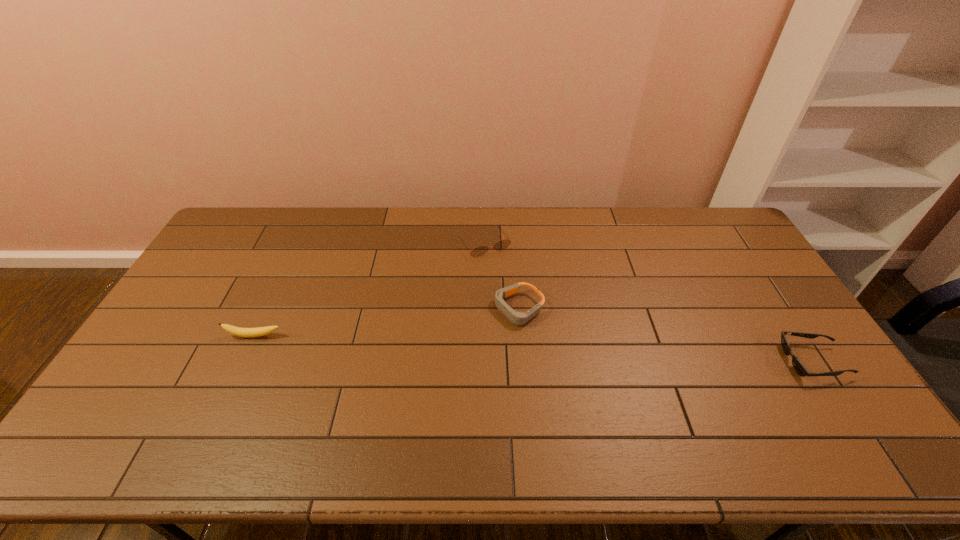
Identify the location of the second nearest object. The image size is (960, 540). (237, 331).

I want to click on the leftmost object, so click(237, 331).

Image resolution: width=960 pixels, height=540 pixels. What are the coordinates of `the nearest object` in the screenshot? It's located at (798, 366).

This screenshot has width=960, height=540. Find the location of `the nearer sunglasses`. the nearer sunglasses is located at coordinates (798, 366).

At what (x,y) coordinates should I click in order to perform the action: click on goggles. Please return your answer as a coordinate pair (x, y). The width and height of the screenshot is (960, 540). Looking at the image, I should click on (518, 318).

Identify the location of the farthest object. (502, 244).

Image resolution: width=960 pixels, height=540 pixels. Find the location of `the left sunglasses`. the left sunglasses is located at coordinates (502, 244).

I want to click on free space located 0.250m on the upward curve of the second nearest object, so click(x=216, y=419).

Find the location of a particular element. vacant space located on the front-facing side of the rightmost object is located at coordinates (706, 361).

This screenshot has height=540, width=960. In order to click on vacant region located 0.300m on the front-facing side of the rightmost object in this screenshot , I will do `click(677, 361)`.